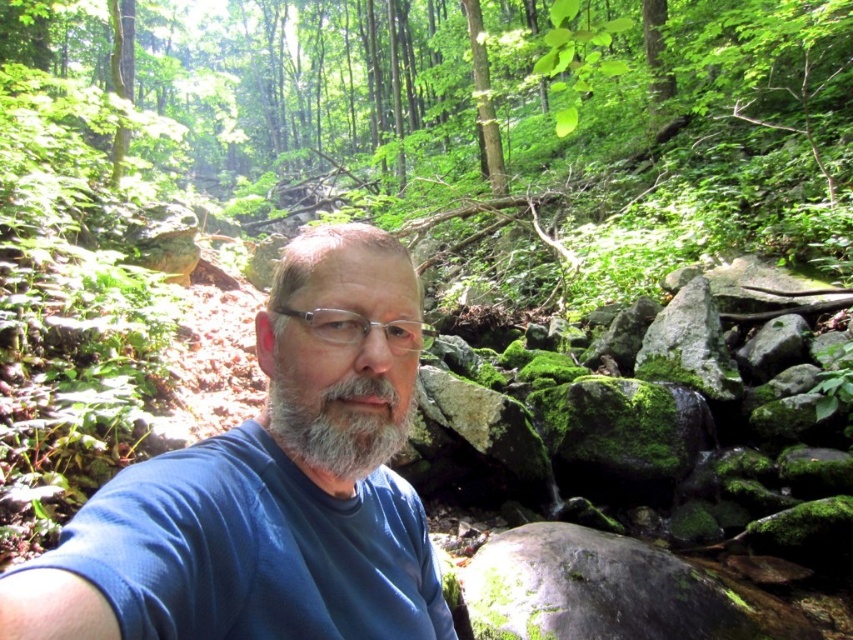
Question: Does gray matte beard at center have a greater width compared to clear plastic glasses at center?

Choices:
 (A) yes
 (B) no

Answer: (B)

Question: Which object appears closest to the camera in this image?

Choices:
 (A) gray matte beard at center
 (B) clear plastic glasses at center

Answer: (A)

Question: Estimate the real-world distances between objects in this image. Which object is farther from the clear plastic glasses at center?

Choices:
 (A) gray matte beard at center
 (B) blue fabric shirt at center

Answer: (B)

Question: Can you confirm if blue fabric shirt at center is smaller than gray matte beard at center?

Choices:
 (A) yes
 (B) no

Answer: (B)

Question: Can you confirm if blue fabric shirt at center is positioned above clear plastic glasses at center?

Choices:
 (A) no
 (B) yes

Answer: (A)

Question: Which point appears closest to the camera in this image?

Choices:
 (A) (270, 392)
 (B) (409, 412)
 (C) (302, 317)

Answer: (C)